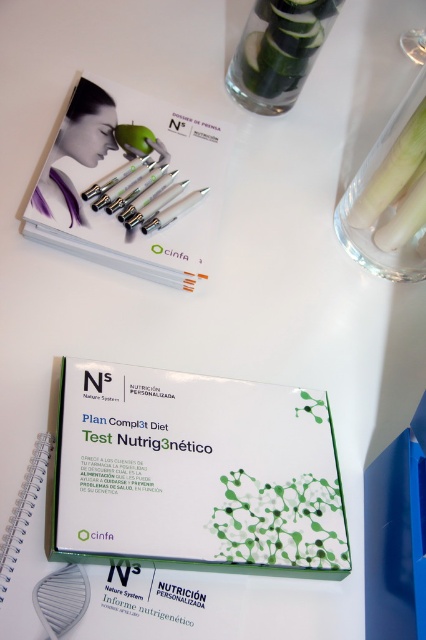
You are a customer at a health expo booth and see the transparent glass vase at upper right and the clear plastic pens at upper center on the table. You want to place a business card between them. Is there enough space to fit a standard 3.5 inch long business card between the two items?

The transparent glass vase at upper right and clear plastic pens at upper center are 10.26 inches apart, so yes, there is enough space to fit a standard 3.5 inch long business card between them since the distance is greater than the card length.

You are standing 6 feet away from the table. A point on the table is labeled as point (106,545). Can you reach this point without moving your position? Please explain your reasoning.

The point (106,545) is 20.79 inches away from the camera. Since you are standing 6 feet away from the table, which is 72 inches, the point is within your reach as 20.79 inches is less than 72 inches. However, reaching across the table might depend on your arm length and the table dimensions not specified here.